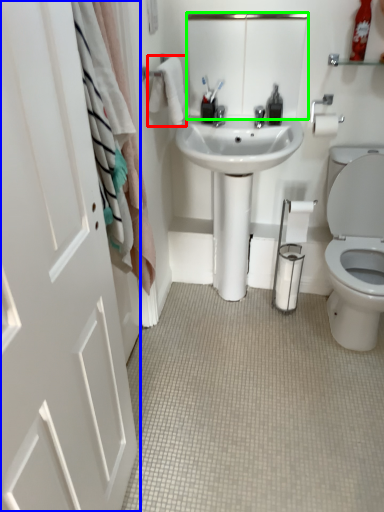
Question: Based on their relative distances, which object is nearer to bath towel (highlighted by a red box)? Choose from door (highlighted by a blue box) and mirror (highlighted by a green box).

Choices:
 (A) door
 (B) mirror

Answer: (B)